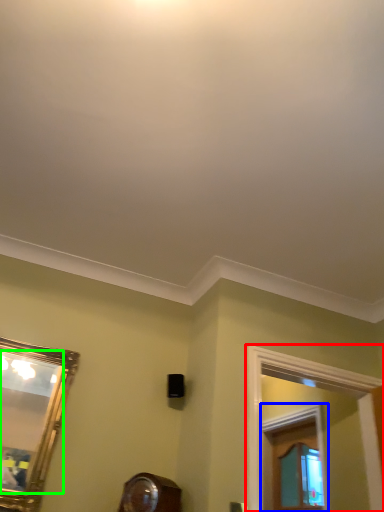
Question: Which object is positioned closest to window frame (highlighted by a red box)? Select from window frame (highlighted by a blue box) and mirror (highlighted by a green box).

Choices:
 (A) window frame
 (B) mirror

Answer: (A)